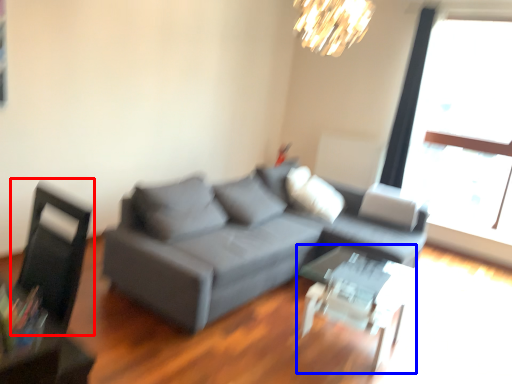
Question: Among these objects, which one is nearest to the camera, swivel chair (highlighted by a red box) or table (highlighted by a blue box)?

Choices:
 (A) swivel chair
 (B) table

Answer: (A)